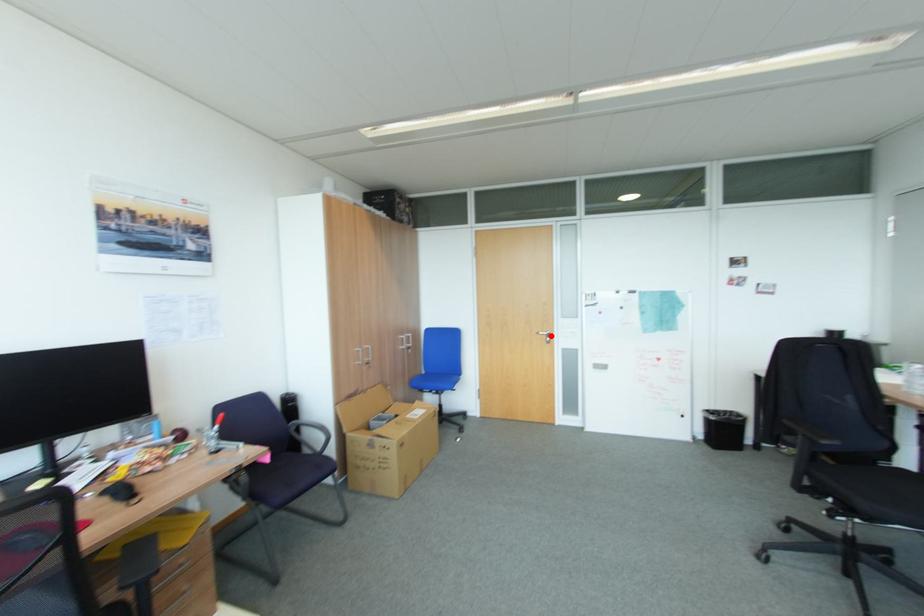
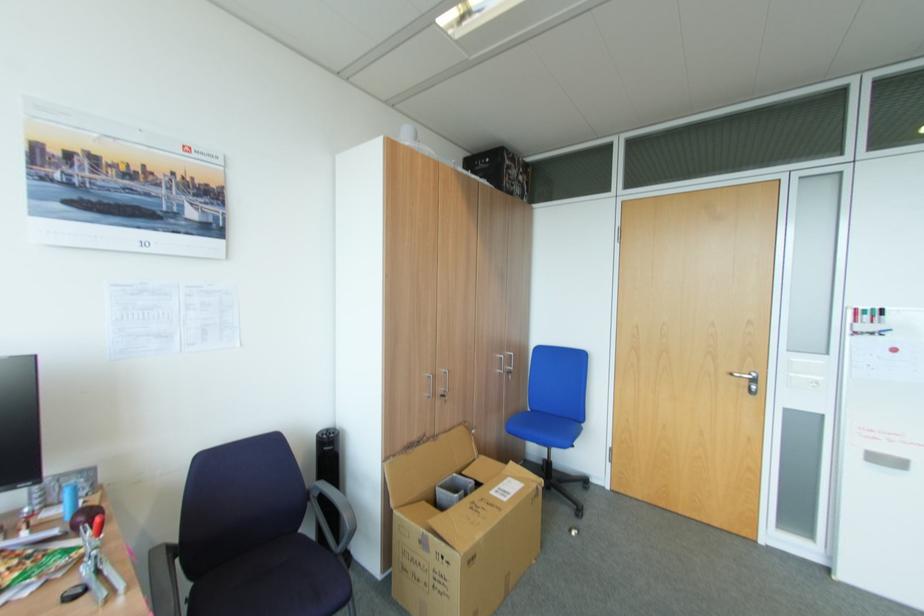
Where in the second image is the point corresponding to the highlighted location from the first image?

(751, 381)